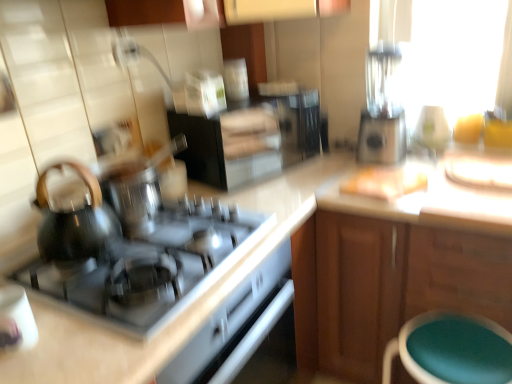
Locate an element on the screen. Image resolution: width=512 pixels, height=384 pixels. vacant space situated above wooden cabinet at right (from a real-world perspective) is located at coordinates (425, 182).